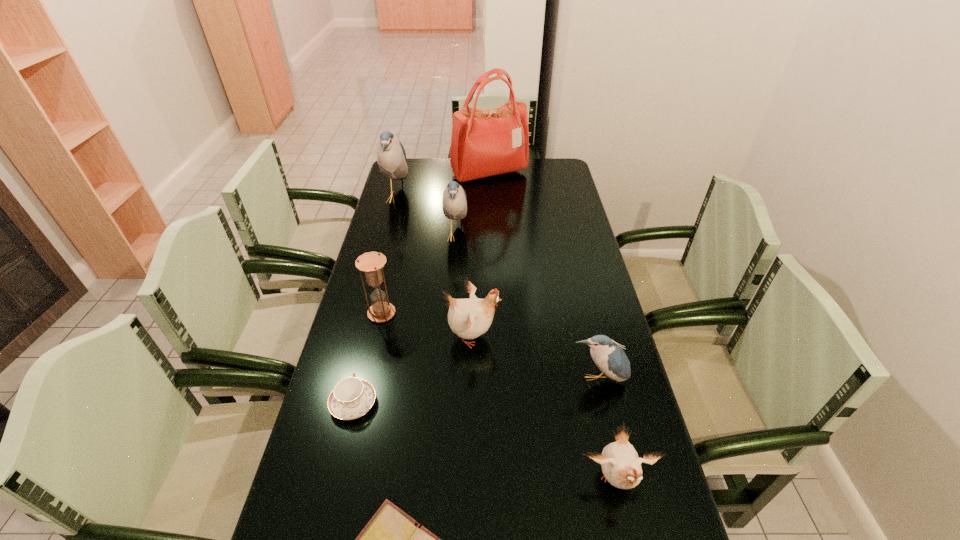
Select which object appears as the sixth closest to the third farthest bird. Please provide its 2D coordinates. Your answer should be formatted as a tuple, i.e. [(x, y)], where the tuple contains the x and y coordinates of a point satisfying the conditions above.

[(392, 539)]

Identify which object is the nearest to the farthest blue bird. Please provide its 2D coordinates. Your answer should be formatted as a tuple, i.e. [(x, y)], where the tuple contains the x and y coordinates of a point satisfying the conditions above.

[(485, 142)]

Locate which bird ranks in proximity to the nearer white bird. Please provide its 2D coordinates. Your answer should be formatted as a tuple, i.e. [(x, y)], where the tuple contains the x and y coordinates of a point satisfying the conditions above.

[(609, 357)]

Locate which bird ranks in proximity to the tallest object. Please provide its 2D coordinates. Your answer should be formatted as a tuple, i.e. [(x, y)], where the tuple contains the x and y coordinates of a point satisfying the conditions above.

[(391, 157)]

Find the location of a particular element. The height and width of the screenshot is (540, 960). blue bird that is the third closest to the farther white bird is located at coordinates (391, 157).

Select which blue bird appears as the second closest to the brown hourglass. Please provide its 2D coordinates. Your answer should be formatted as a tuple, i.e. [(x, y)], where the tuple contains the x and y coordinates of a point satisfying the conditions above.

[(391, 157)]

In order to click on free space that satisfies the following two spatial constraints: 1. on the side with the handle of the teacup; 2. at the tip of the tallest bird's beak in this screenshot , I will do `click(403, 198)`.